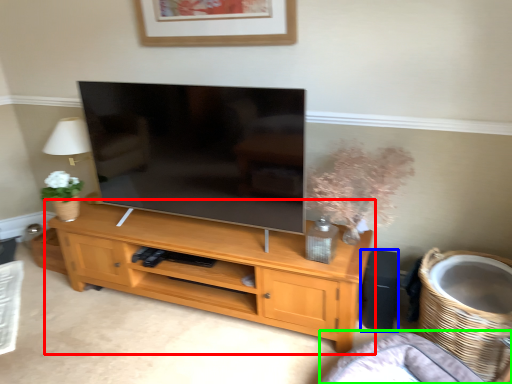
Question: Estimate the real-world distances between objects in this image. Which object is closer to shelf (highlighted by a red box), speaker (highlighted by a blue box) or couch (highlighted by a green box)?

Choices:
 (A) speaker
 (B) couch

Answer: (B)